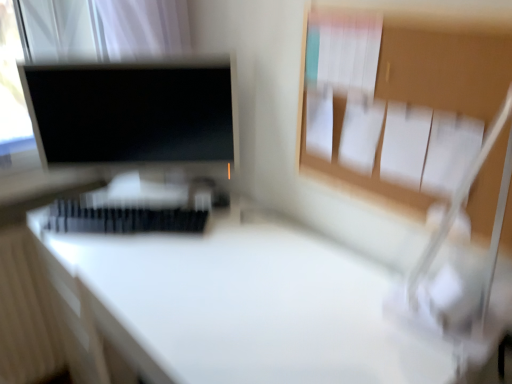
This screenshot has width=512, height=384. Describe the element at coordinates (234, 308) in the screenshot. I see `white glossy desk at center` at that location.

Find the location of `white glossy desk at center`. white glossy desk at center is located at coordinates (234, 308).

What do you see at coordinates (135, 212) in the screenshot? The image size is (512, 384). I see `white plastic keyboard at center` at bounding box center [135, 212].

Locate an element on the screen. This screenshot has width=512, height=384. matte black monitor at upper left is located at coordinates (132, 112).

The image size is (512, 384). I want to click on white glossy desk at center, so point(234,308).

Is the depth of matte black monitor at upper left less than that of white plastic keyboard at center?

No, the depth of matte black monitor at upper left is greater than that of white plastic keyboard at center.

You are a GUI agent. You are given a task and a screenshot of the screen. Output one action in this format:
    pyautogui.click(x=<x>, y=<y>)
    Task: Click on the computer monitor that is above the white plastic keyboard at center (from the image's perspective)
    The image size is (512, 384).
    Given the screenshot: What is the action you would take?
    pyautogui.click(x=132, y=112)

Looking at their sizes, would you say matte black monitor at upper left is wider or thinner than white plastic keyboard at center?

In the image, matte black monitor at upper left appears to be wider than white plastic keyboard at center.

What's the angular difference between white plastic keyboard at center and matte black monitor at upper left's facing directions?

They differ by 4.56 degrees in their facing directions.

Which point is more distant from viewer, (x=145, y=221) or (x=68, y=139)?

The point (x=68, y=139) is farther.

Based on the photo, from the image's perspective, is white plastic keyboard at center under matte black monitor at upper left?

Yes, from the image's perspective, white plastic keyboard at center is beneath matte black monitor at upper left.

Is white plastic keyboard at center oriented towards matte black monitor at upper left?

No, white plastic keyboard at center is not facing towards matte black monitor at upper left.

Can you confirm if matte black monitor at upper left is bigger than white glossy desk at center?

No, matte black monitor at upper left is not bigger than white glossy desk at center.

Which object is thinner, matte black monitor at upper left or white glossy desk at center?

Thinner between the two is matte black monitor at upper left.

From the image's perspective, who appears lower, matte black monitor at upper left or white glossy desk at center?

white glossy desk at center.

Does matte black monitor at upper left appear on the left side of white glossy desk at center?

Indeed, matte black monitor at upper left is positioned on the left side of white glossy desk at center.

Considering the relative sizes of white plastic keyboard at center and white glossy desk at center in the image provided, is white plastic keyboard at center wider than white glossy desk at center?

No, white plastic keyboard at center is not wider than white glossy desk at center.

Considering the relative sizes of white plastic keyboard at center and white glossy desk at center in the image provided, is white plastic keyboard at center bigger than white glossy desk at center?

No, white plastic keyboard at center is not bigger than white glossy desk at center.

Is white plastic keyboard at center turned away from white glossy desk at center?

No, white plastic keyboard at center is not facing the opposite direction of white glossy desk at center.

Which is nearer, (226, 242) or (170, 95)?

The point (226, 242) is closer.

From a real-world perspective, is white glossy desk at center over matte black monitor at upper left?

No, from a real-world perspective, white glossy desk at center is not on top of matte black monitor at upper left.

Is matte black monitor at upper left located within white glossy desk at center?

No, matte black monitor at upper left is not a part of white glossy desk at center.

Who is bigger, white glossy desk at center or matte black monitor at upper left?

Bigger between the two is white glossy desk at center.

From a real-world perspective, is white glossy desk at center positioned above or below white plastic keyboard at center?

white glossy desk at center is situated lower than white plastic keyboard at center in the real world.

Is white glossy desk at center to the left of white plastic keyboard at center from the viewer's perspective?

Incorrect, white glossy desk at center is not on the left side of white plastic keyboard at center.

Image resolution: width=512 pixels, height=384 pixels. What are the coordinates of `bed behind the white glossy desk at center` in the screenshot? It's located at (135, 212).

Is point (165, 317) less distant than point (139, 217)?

Yes, it is.

Find the location of a particular element. This screenshot has height=384, width=512. computer monitor that is on the right side of white plastic keyboard at center is located at coordinates (132, 112).

Identify the location of bed below the matte black monitor at upper left (from the image's perspective). (135, 212).

Estimate the real-world distances between objects in this image. Which object is closer to white glossy desk at center, white plastic keyboard at center or matte black monitor at upper left?

white plastic keyboard at center is closer to white glossy desk at center.

When comparing their distances from white plastic keyboard at center, does white glossy desk at center or matte black monitor at upper left seem closer?

white glossy desk at center is closer to white plastic keyboard at center.

Looking at the image, which one is located further to white plastic keyboard at center, matte black monitor at upper left or white glossy desk at center?

matte black monitor at upper left lies further to white plastic keyboard at center than the other object.

When comparing their distances from white glossy desk at center, does matte black monitor at upper left or white plastic keyboard at center seem closer?

The object closer to white glossy desk at center is white plastic keyboard at center.

Estimate the real-world distances between objects in this image. Which object is further from matte black monitor at upper left, white plastic keyboard at center or white glossy desk at center?

white glossy desk at center is positioned further to the anchor matte black monitor at upper left.

From the image, which object appears to be nearer to matte black monitor at upper left, white glossy desk at center or white plastic keyboard at center?

white plastic keyboard at center is closer to matte black monitor at upper left.

Where is `bed between matte black monitor at upper left and white glossy desk at center from top to bottom`? This screenshot has width=512, height=384. bed between matte black monitor at upper left and white glossy desk at center from top to bottom is located at coordinates (135, 212).